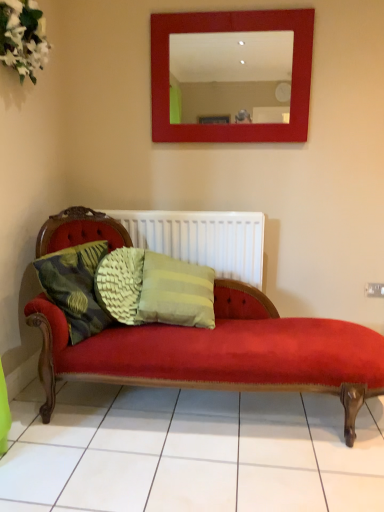
Question: Is white textured radiator at center facing away from green textured cushion at left?

Choices:
 (A) yes
 (B) no

Answer: (B)

Question: Is white textured radiator at center smaller than green textured cushion at left?

Choices:
 (A) yes
 (B) no

Answer: (B)

Question: Is white textured radiator at center bigger than green textured cushion at left?

Choices:
 (A) yes
 (B) no

Answer: (A)

Question: Does white textured radiator at center appear on the left side of green textured cushion at left?

Choices:
 (A) no
 (B) yes

Answer: (A)

Question: Is the position of white textured radiator at center more distant than that of green textured cushion at left?

Choices:
 (A) no
 (B) yes

Answer: (B)

Question: Is white textured radiator at center aimed at green textured cushion at left?

Choices:
 (A) no
 (B) yes

Answer: (B)

Question: From a real-world perspective, is white textured radiator at center positioned under white fabric flowers at upper left based on gravity?

Choices:
 (A) no
 (B) yes

Answer: (B)

Question: Is white textured radiator at center positioned far away from white fabric flowers at upper left?

Choices:
 (A) no
 (B) yes

Answer: (B)

Question: Can you confirm if white textured radiator at center is thinner than white fabric flowers at upper left?

Choices:
 (A) yes
 (B) no

Answer: (A)

Question: Does white textured radiator at center turn towards white fabric flowers at upper left?

Choices:
 (A) yes
 (B) no

Answer: (B)

Question: Considering the relative sizes of white textured radiator at center and white fabric flowers at upper left in the image provided, is white textured radiator at center wider than white fabric flowers at upper left?

Choices:
 (A) no
 (B) yes

Answer: (A)

Question: Is white textured radiator at center beside white fabric flowers at upper left?

Choices:
 (A) no
 (B) yes

Answer: (A)

Question: Can you confirm if white fabric flowers at upper left is positioned to the right of white textured radiator at center?

Choices:
 (A) no
 (B) yes

Answer: (A)